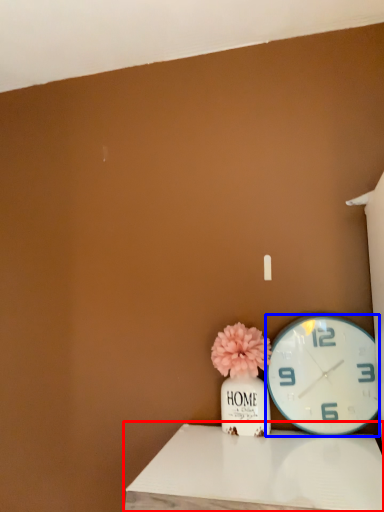
Question: Which object is closer to the camera taking this photo, table (highlighted by a red box) or wall clock (highlighted by a blue box)?

Choices:
 (A) table
 (B) wall clock

Answer: (A)